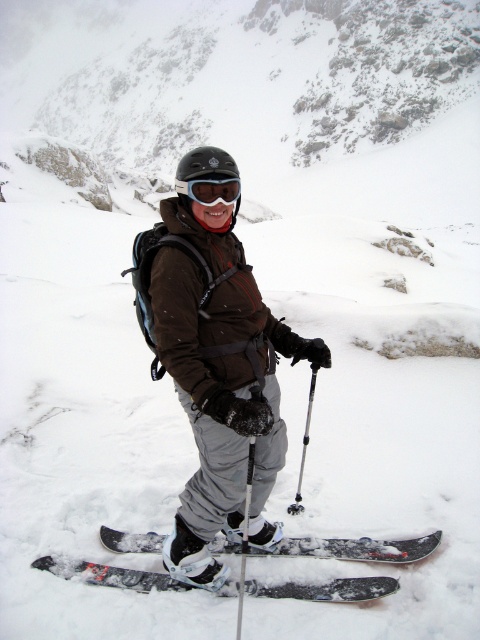
Question: Which point is farther from the camera taking this photo?

Choices:
 (A) (231, 188)
 (B) (242, 548)

Answer: (B)

Question: Considering the real-world distances, which object is farthest from the brown matte jacket at center?

Choices:
 (A) transparent plastic goggles at center
 (B) black matte skis at center
 (C) metallic silver ski pole at center
 (D) silver metallic ski pole at center

Answer: (D)

Question: Is black matte skis at center closer to camera compared to silver metallic ski pole at center?

Choices:
 (A) yes
 (B) no

Answer: (A)

Question: Can you confirm if transparent plastic goggles at center is positioned to the left of metallic silver ski pole at center?

Choices:
 (A) no
 (B) yes

Answer: (B)

Question: Which of the following is the farthest from the observer?

Choices:
 (A) black matte skis at center
 (B) silver metallic ski pole at center
 (C) transparent plastic goggles at center
 (D) metallic silver ski pole at center

Answer: (B)

Question: Is black matte skis at center positioned at the back of transparent plastic goggles at center?

Choices:
 (A) no
 (B) yes

Answer: (B)